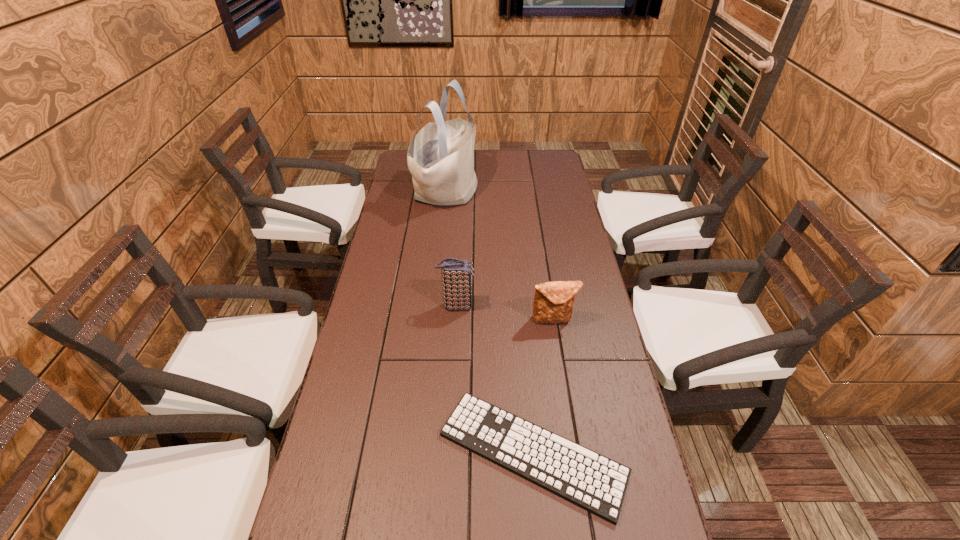
You are a GUI agent. You are given a task and a screenshot of the screen. Output one action in this format:
    pyautogui.click(x=<x>, y=<y>)
    Task: Click on the free space between the tallest object and the second tallest object
    
    Given the screenshot: What is the action you would take?
    [x=452, y=248]

Locate an element on the screen. free space that is in between the farthest object and the taller clutch bag is located at coordinates (452, 248).

Locate an element on the screen. the third closest object to the computer keyboard is located at coordinates (440, 158).

I want to click on object that is the closest to the nearest object, so click(553, 303).

The width and height of the screenshot is (960, 540). Find the location of `free space in the image that satisfies the following two spatial constraints: 1. on the front side of the shortest object; 2. on the left side of the farthest object`. free space in the image that satisfies the following two spatial constraints: 1. on the front side of the shortest object; 2. on the left side of the farthest object is located at coordinates (420, 453).

The image size is (960, 540). What are the coordinates of `free spot that satisfies the following two spatial constraints: 1. with the zip open on the computer keyboard; 2. on the left side of the third shortest object` in the screenshot? It's located at (449, 453).

I want to click on vacant space that satisfies the following two spatial constraints: 1. with the zip open on the left clutch bag; 2. on the right side of the computer keyboard, so click(x=449, y=453).